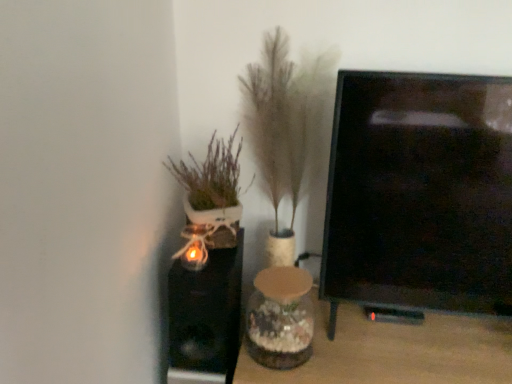
Question: Choose the correct answer: Is white ceramic pot at left, arranged as the second houseplant when viewed from the right, inside fuzzy beige plant at center, which is the 1th houseplant from right to left, or outside it?

Choices:
 (A) outside
 (B) inside

Answer: (A)

Question: Is point (196, 231) positioned closer to the camera than point (266, 49)?

Choices:
 (A) farther
 (B) closer

Answer: (B)

Question: Which object is the closest to the white ceramic pot at left, marked as the first houseplant in a left-to-right arrangement?

Choices:
 (A) translucent glass vase at center
 (B) clear glass vase at center
 (C) fuzzy beige plant at center, which is the 1th houseplant from right to left

Answer: (C)

Question: Considering the real-world distances, which object is farthest from the fuzzy beige plant at center, which is the 1th houseplant from right to left?

Choices:
 (A) white ceramic pot at left, arranged as the second houseplant when viewed from the right
 (B) clear glass vase at center
 (C) translucent glass vase at center

Answer: (B)